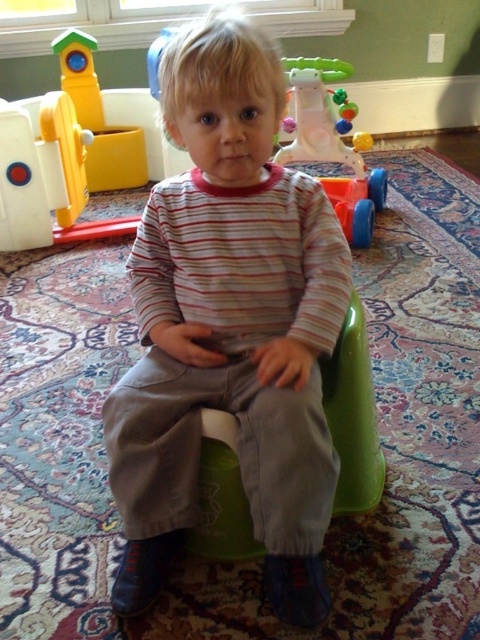
You are a toy organizer in the room. You need to place a new toy on the floor near the point at coordinates [229,326]. Which object is at that point?

The point at coordinates [229,326] is on the matte striped shirt at center.

From the picture: You are a parent trying to clean up the playroom. You need to move the green plastic chair at center to store it. Which object, the matte plastic walker at upper center or another toy, is blocking the path to the storage area?

The green plastic chair at center is behind the matte plastic walker at upper center, so the matte plastic walker at upper center is blocking the path.